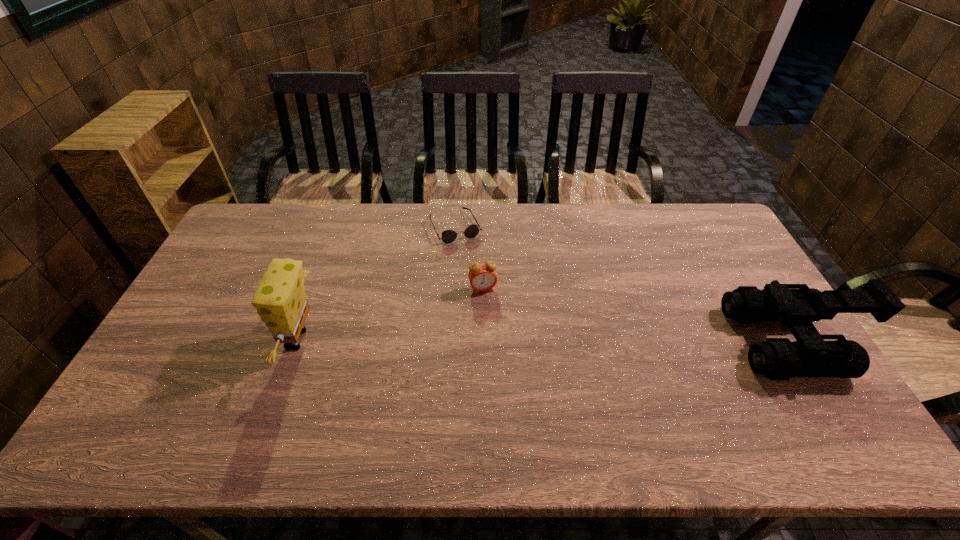
At what (x,y) coordinates should I click in order to perform the action: click on vacant space on the desktop that is between the sponge and the third shortest object and is positioned on the face of the second shortest object. Please return your answer as a coordinate pair (x, y). Looking at the image, I should click on (495, 340).

The height and width of the screenshot is (540, 960). Find the location of `free space on the desktop that is between the sponge and the binoculars and is positioned on the front-facing side of the sunglasses`. free space on the desktop that is between the sponge and the binoculars and is positioned on the front-facing side of the sunglasses is located at coordinates (514, 340).